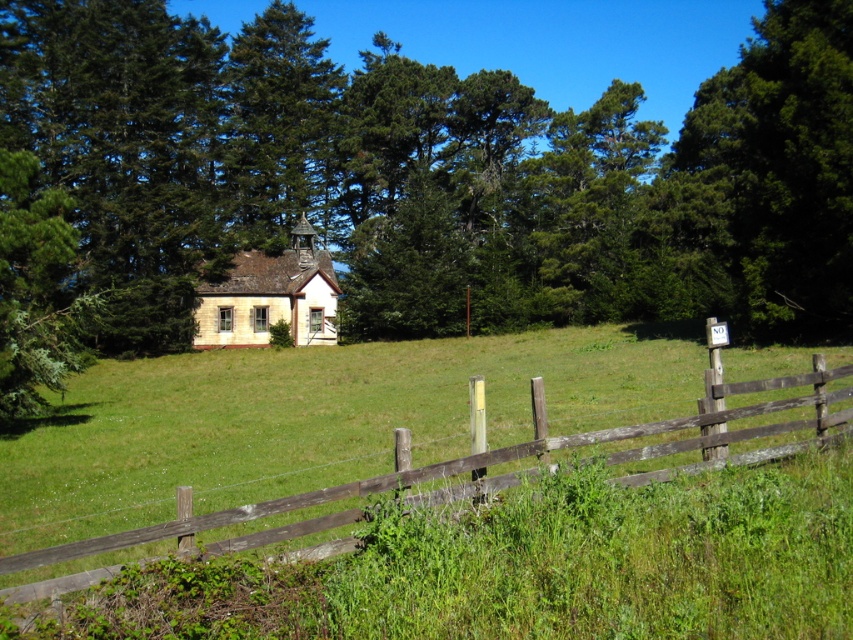
Question: Among these points, which one is nearest to the camera?

Choices:
 (A) (219, 266)
 (B) (169, 401)

Answer: (B)

Question: Can you confirm if brown wooden fence at center is positioned to the right of green leafy tree at upper right?

Choices:
 (A) yes
 (B) no

Answer: (B)

Question: Can you confirm if brown wooden fence at center is positioned below yellow stone church at center?

Choices:
 (A) no
 (B) yes

Answer: (B)

Question: Estimate the real-world distances between objects in this image. Which object is closer to the brown wooden fence at center?

Choices:
 (A) green leafy tree at center
 (B) yellow stone church at center
 (C) green leafy tree at upper right

Answer: (B)

Question: Which point appears closest to the camera in this image?

Choices:
 (A) (292, 246)
 (B) (601, 396)
 (C) (787, 163)

Answer: (B)

Question: Is green leafy tree at center thinner than yellow stone church at center?

Choices:
 (A) no
 (B) yes

Answer: (A)